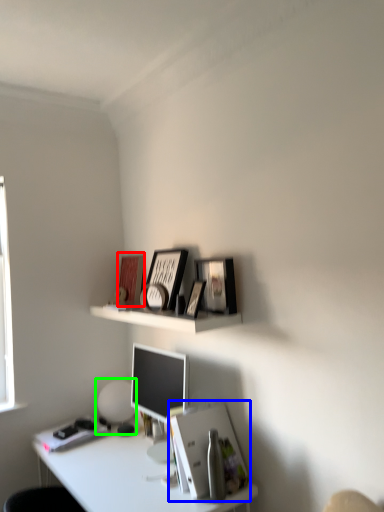
Question: Estimate the real-world distances between objects in this image. Which object is closer to book cover (highlighted by a red box), paperback book (highlighted by a blue box) or table lamp (highlighted by a green box)?

Choices:
 (A) paperback book
 (B) table lamp

Answer: (B)